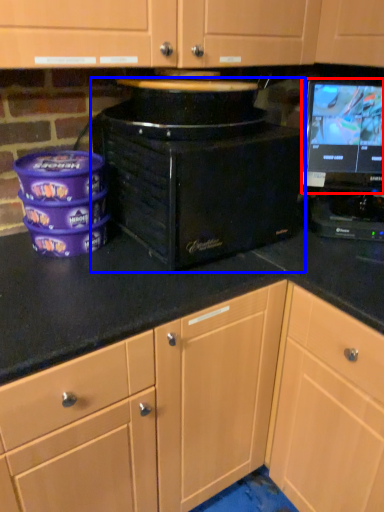
Question: Which object is closer to the camera taking this photo, computer monitor (highlighted by a red box) or home appliance (highlighted by a blue box)?

Choices:
 (A) computer monitor
 (B) home appliance

Answer: (B)